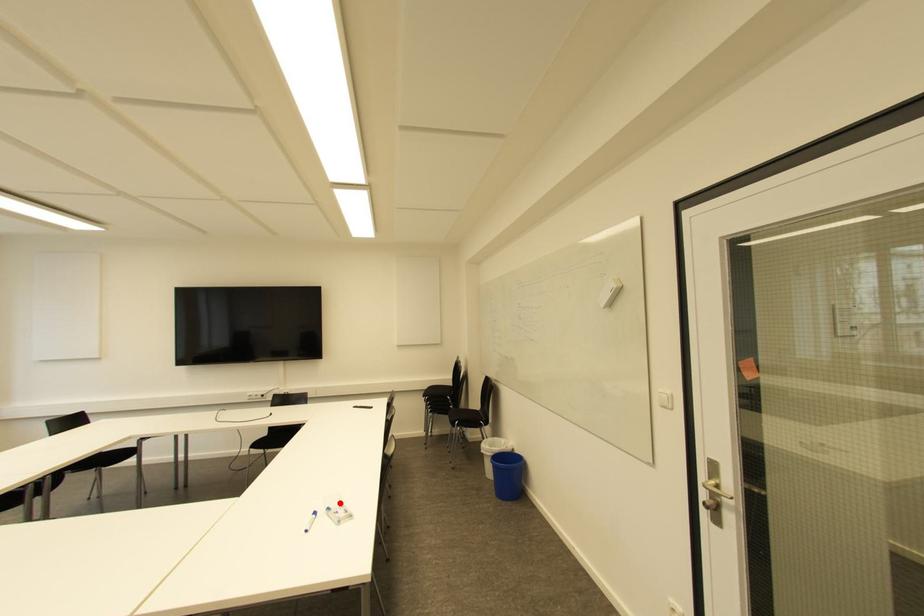
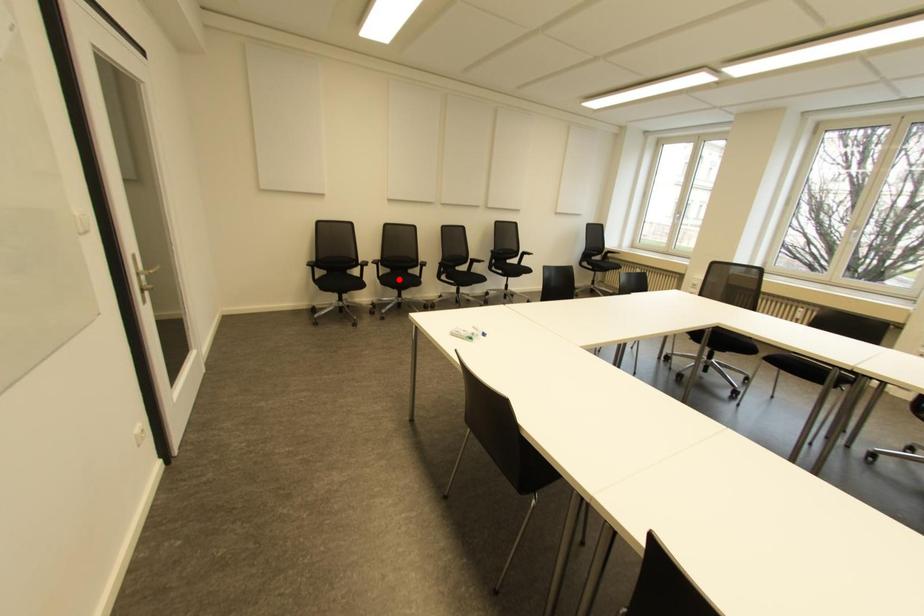
I am providing you with two images of the same scene from different viewpoints. A red point is marked on the first image and another point is marked on the second image. Does the point marked in image1 correspond to the same location as the one in image2?

No